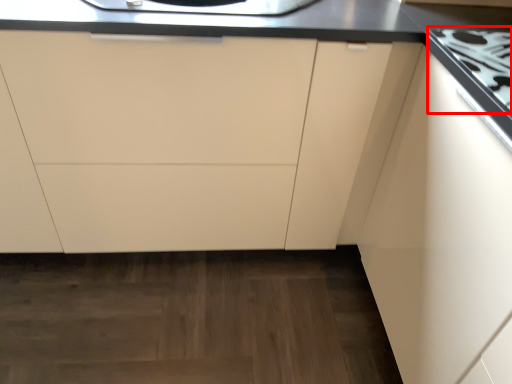
Question: From the image's perspective, considering the relative positions of gas stove (annotated by the red box) and cabinetry in the image provided, where is gas stove (annotated by the red box) located with respect to the staircase?

Choices:
 (A) above
 (B) below

Answer: (A)